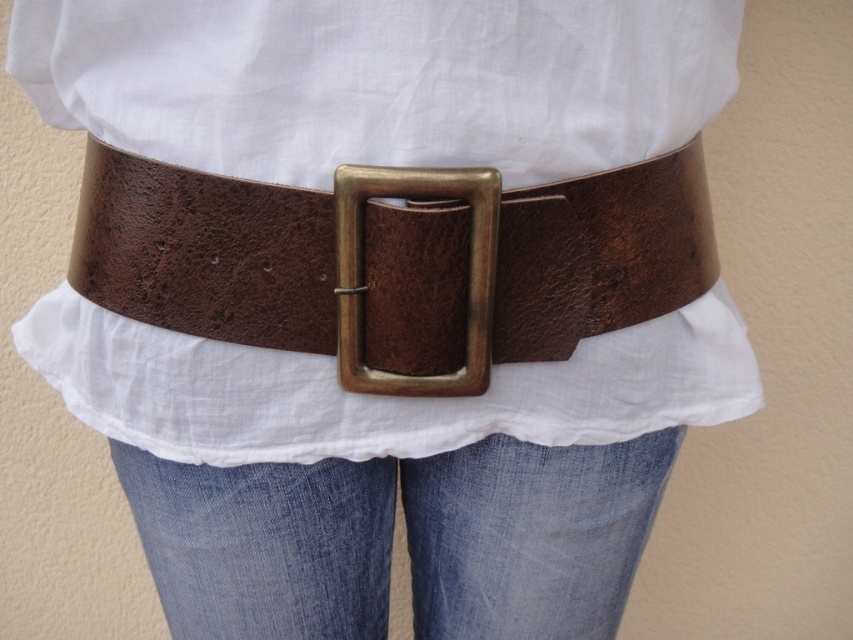
Is brown leather belt at center bigger than antique brass buckle at center?

Correct, brown leather belt at center is larger in size than antique brass buckle at center.

Which is more to the left, brown leather belt at center or antique brass buckle at center?

Positioned to the left is brown leather belt at center.

Describe the element at coordinates (206, 252) in the screenshot. I see `brown leather belt at center` at that location.

Locate an element on the screen. The height and width of the screenshot is (640, 853). brown leather belt at center is located at coordinates (206, 252).

Is denim at center above antique brass buckle at center?

Actually, denim at center is below antique brass buckle at center.

In the scene shown: Which is above, denim at center or antique brass buckle at center?

antique brass buckle at center is above.

Measure the distance between point (560, 497) and camera.

Point (560, 497) is 35.77 inches from camera.

This screenshot has height=640, width=853. I want to click on denim at center, so click(529, 534).

Does brown leather belt at center appear under denim at center?

Incorrect, brown leather belt at center is not positioned below denim at center.

What do you see at coordinates (206, 252) in the screenshot? I see `brown leather belt at center` at bounding box center [206, 252].

I want to click on brown leather belt at center, so click(x=206, y=252).